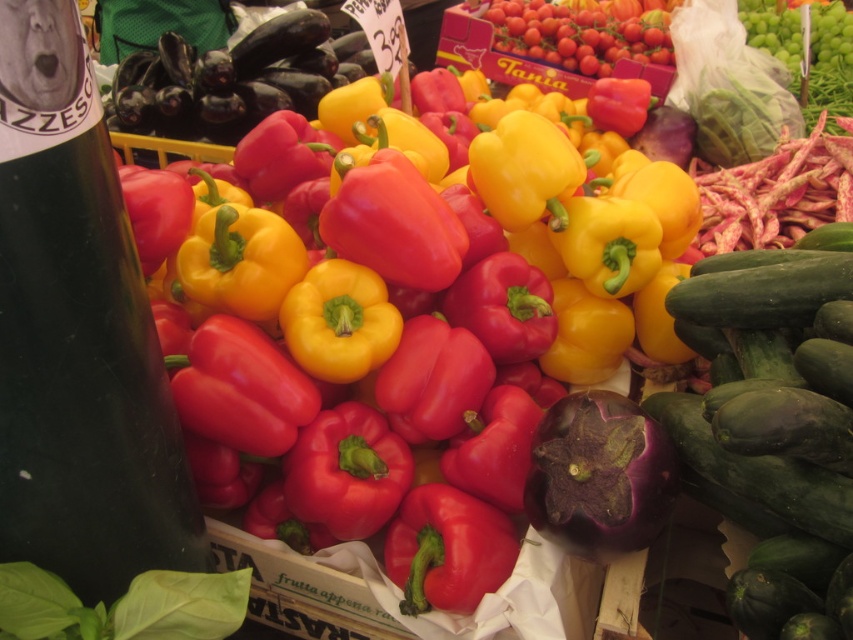
Consider the image. You are a vendor at the market and want to place a new sign between the shiny red bell pepper at center and the green smooth cucumber at right. The sign is 10 cm wide. Can you fit it between them without moving any produce?

The shiny red bell pepper at center might be wider than green smooth cucumber at right, so the distance between them is uncertain. Therefore, it is not possible to determine if the 10 cm wide sign can fit without knowing the exact space available.

You are a customer at the market stall and want to pick the shiny red bell pepper at center. Based on its coordinates, where exactly should you look to find it?

The shiny red bell pepper at center is located at point [419,339], so you should look there to find it.

You are a customer at the market stall and want to buy a vegetable that is larger in size. Looking at the shiny red bell pepper at center and the green smooth cucumber at right, which one should you choose?

The shiny red bell pepper at center is bigger than the green smooth cucumber at right, so you should choose the shiny red bell pepper at center.